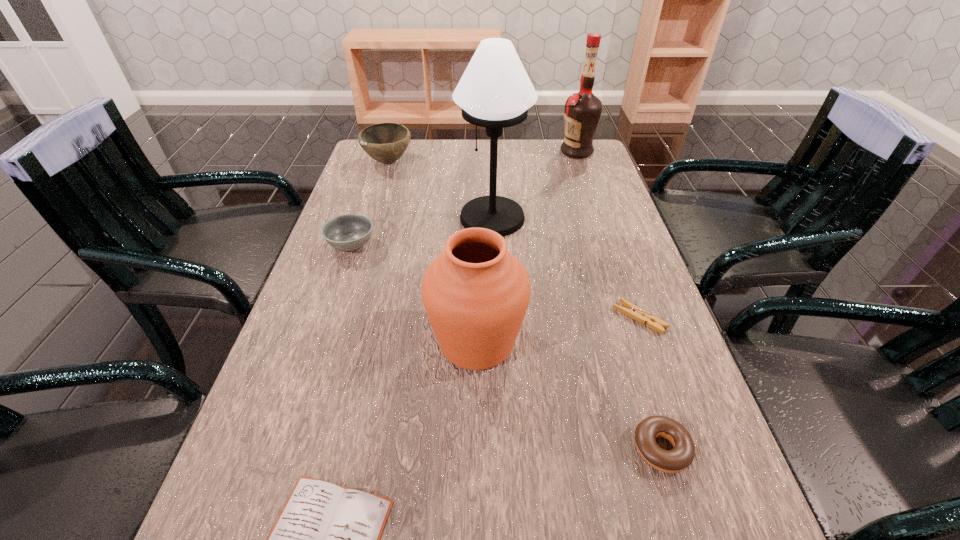
In order to click on the tallest object in this screenshot , I will do `click(495, 92)`.

The width and height of the screenshot is (960, 540). Identify the location of liquor. (582, 112).

Locate an element on the screen. This screenshot has height=540, width=960. the third tallest object is located at coordinates (476, 293).

Locate an element on the screen. The width and height of the screenshot is (960, 540). the fifth shortest object is located at coordinates [x=386, y=142].

Where is `the farther bowl`? The image size is (960, 540). the farther bowl is located at coordinates (386, 142).

In order to click on the nearer bowl in this screenshot , I will do `click(349, 232)`.

Find the location of a particular element. the shorter bowl is located at coordinates (349, 232).

The height and width of the screenshot is (540, 960). I want to click on the third shortest object, so click(x=676, y=460).

I want to click on clothespin, so click(632, 311).

In order to click on vacant region located on the right of the table lamp in this screenshot , I will do `click(624, 218)`.